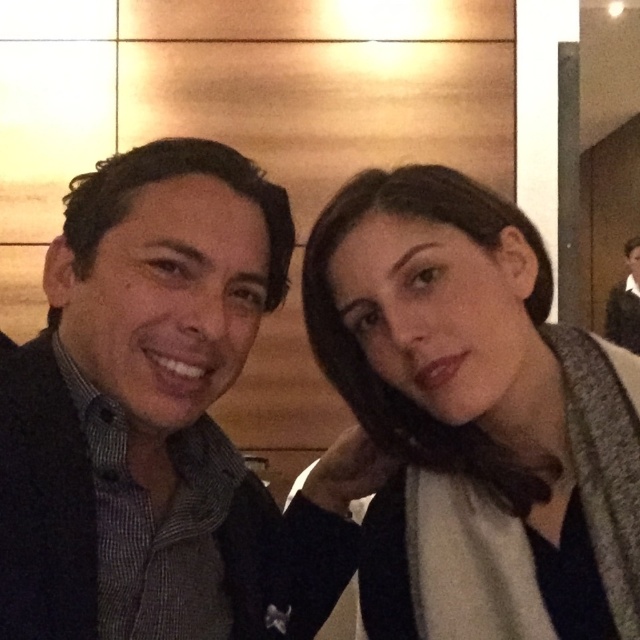
Question: Among these objects, which one is farthest from the camera?

Choices:
 (A) dark brown leather jacket at upper right
 (B) matte gray scarf at center
 (C) matte black jacket at left

Answer: (A)

Question: In this image, where is matte black jacket at left located relative to dark brown leather jacket at upper right?

Choices:
 (A) left
 (B) right

Answer: (A)

Question: Can you confirm if matte gray scarf at center is bigger than matte black jacket at left?

Choices:
 (A) no
 (B) yes

Answer: (A)

Question: Among these objects, which one is nearest to the camera?

Choices:
 (A) matte gray scarf at center
 (B) dark brown leather jacket at upper right

Answer: (A)

Question: Estimate the real-world distances between objects in this image. Which object is farther from the matte gray scarf at center?

Choices:
 (A) dark brown leather jacket at upper right
 (B) matte black jacket at left

Answer: (A)

Question: From the image, what is the correct spatial relationship of matte black jacket at left in relation to dark brown leather jacket at upper right?

Choices:
 (A) left
 (B) right

Answer: (A)